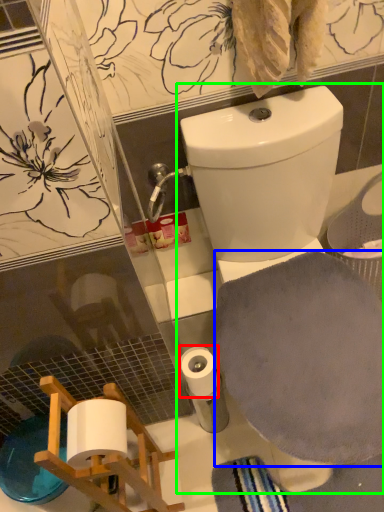
Question: Which object is the farthest from toilet paper (highlighted by a red box)? Choose among these: bath towel (highlighted by a blue box) or toilet (highlighted by a green box).

Choices:
 (A) bath towel
 (B) toilet

Answer: (B)